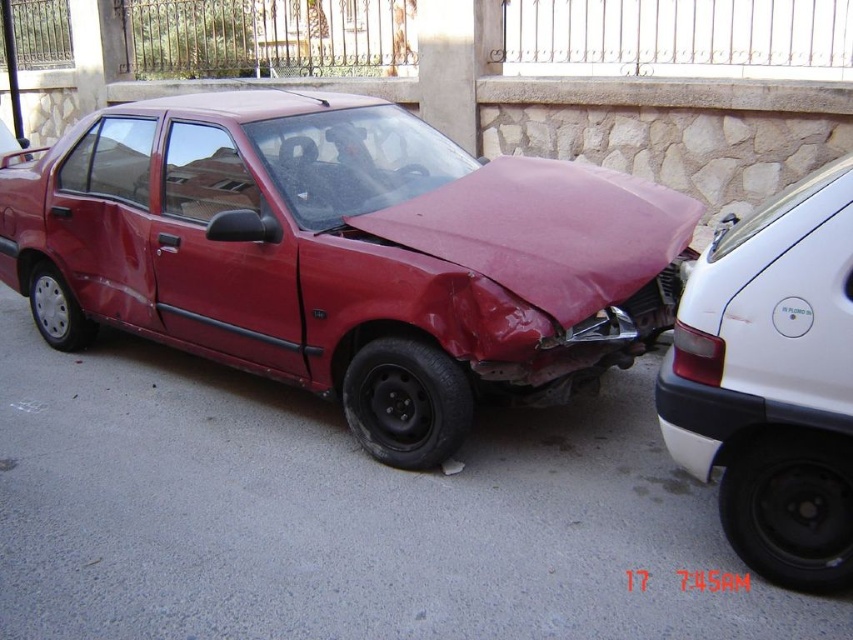
Is point (144, 291) closer to viewer compared to point (822, 506)?

No, it is behind (822, 506).

The height and width of the screenshot is (640, 853). Describe the element at coordinates (343, 253) in the screenshot. I see `matte red car at center` at that location.

The width and height of the screenshot is (853, 640). I want to click on matte red car at center, so click(343, 253).